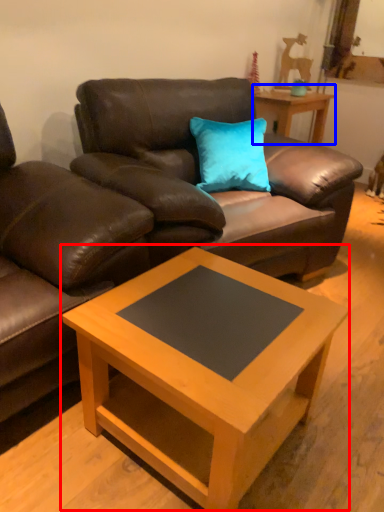
Question: Which point is further to the camera, coffee table (highlighted by a red box) or table (highlighted by a blue box)?

Choices:
 (A) coffee table
 (B) table

Answer: (B)